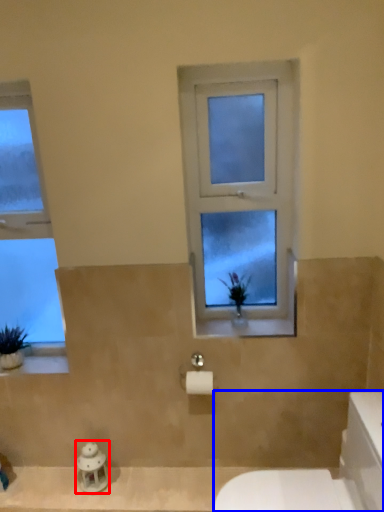
Question: Which of the following is the farthest to the observer, figurine (highlighted by a red box) or porcelain (highlighted by a blue box)?

Choices:
 (A) figurine
 (B) porcelain

Answer: (A)